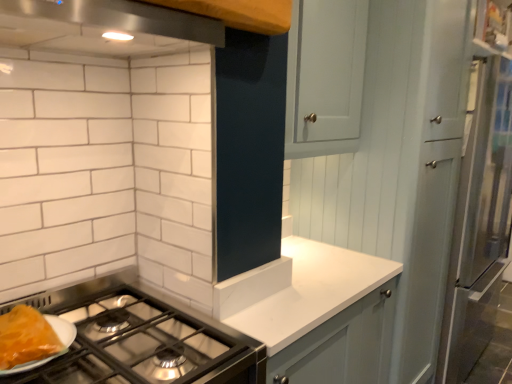
Question: Choose the correct answer: Is stainless steel exhaust hood at upper center inside white laminate countertop at center or outside it?

Choices:
 (A) outside
 (B) inside

Answer: (A)

Question: From the image's perspective, relative to white laminate countertop at center, is stainless steel exhaust hood at upper center above or below?

Choices:
 (A) above
 (B) below

Answer: (A)

Question: Considering the real-world distances, which object is closest to the stainless steel exhaust hood at upper center?

Choices:
 (A) white laminate countertop at center
 (B) shiny orange cheese at lower left

Answer: (B)

Question: Which object is the closest to the shiny orange cheese at lower left?

Choices:
 (A) stainless steel exhaust hood at upper center
 (B) white laminate countertop at center

Answer: (A)